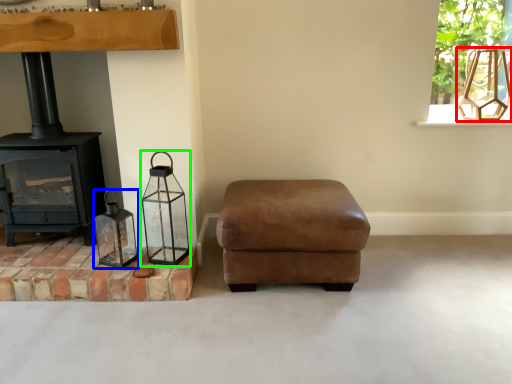
Question: Which is nearer to the lamp (highlighted by a red box)? candle holder (highlighted by a blue box) or candle holder (highlighted by a green box).

Choices:
 (A) candle holder
 (B) candle holder

Answer: (B)